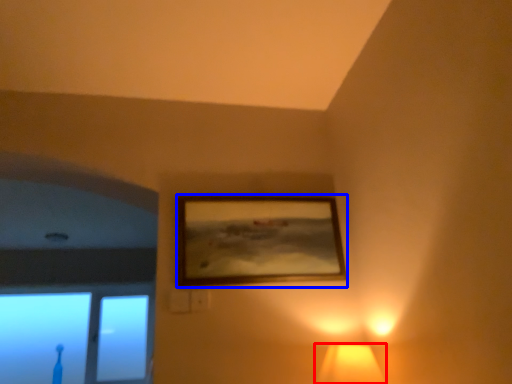
Question: Which object is further to the camera taking this photo, lamp (highlighted by a red box) or picture frame (highlighted by a blue box)?

Choices:
 (A) lamp
 (B) picture frame

Answer: (B)